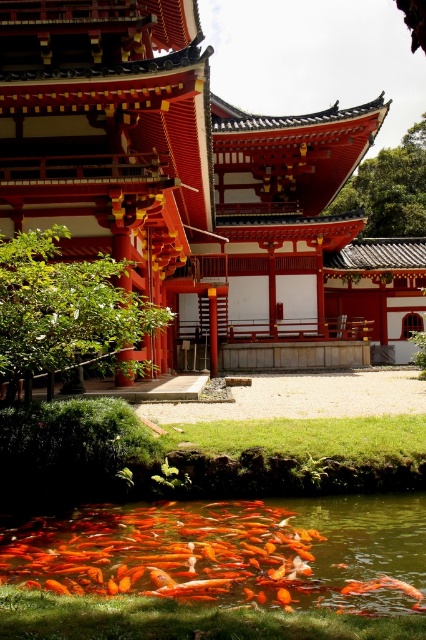
Question: Which of the following is the farthest from the observer?

Choices:
 (A) (385, 577)
 (B) (164, 188)
 (C) (288, 579)

Answer: (B)

Question: Is smooth red wood temple at center above orange glossy fish at lower center?

Choices:
 (A) no
 (B) yes

Answer: (B)

Question: Among these points, which one is nearest to the camera?

Choices:
 (A) (43, 577)
 (B) (333, 266)
 (C) (405, 589)

Answer: (C)

Question: Among these points, which one is nearest to the camera?

Choices:
 (A) [161, 538]
 (B) [385, 579]
 (C) [40, 38]

Answer: (B)

Question: Is smooth red wood temple at center bigger than orange glossy fish at lower center?

Choices:
 (A) yes
 (B) no

Answer: (A)

Question: Does shiny orange fish at lower center appear on the right side of orange glossy fish at lower center?

Choices:
 (A) no
 (B) yes

Answer: (A)